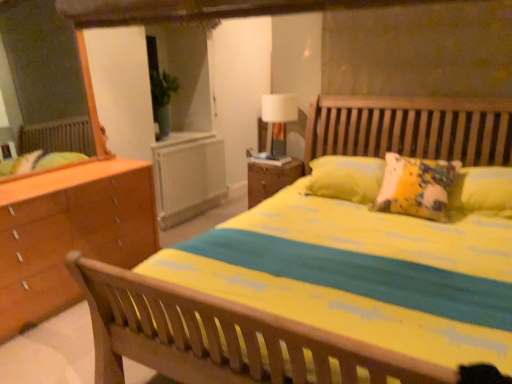
Question: Does wooden nightstand at center contain white plastic radiator at center?

Choices:
 (A) no
 (B) yes

Answer: (A)

Question: Is wooden nightstand at center not inside white plastic radiator at center?

Choices:
 (A) no
 (B) yes

Answer: (B)

Question: Can you confirm if wooden nightstand at center is taller than white plastic radiator at center?

Choices:
 (A) yes
 (B) no

Answer: (B)

Question: Does wooden nightstand at center have a smaller size compared to white plastic radiator at center?

Choices:
 (A) no
 (B) yes

Answer: (A)

Question: Is wooden nightstand at center not close to white plastic radiator at center?

Choices:
 (A) no
 (B) yes

Answer: (A)

Question: Is white plastic radiator at center in front of or behind wooden nightstand at center in the image?

Choices:
 (A) front
 (B) behind

Answer: (B)

Question: From their relative heights in the image, would you say white plastic radiator at center is taller or shorter than wooden nightstand at center?

Choices:
 (A) tall
 (B) short

Answer: (A)

Question: Based on their sizes in the image, would you say white plastic radiator at center is bigger or smaller than wooden nightstand at center?

Choices:
 (A) small
 (B) big

Answer: (A)

Question: Is white plastic radiator at center wider or thinner than wooden nightstand at center?

Choices:
 (A) wide
 (B) thin

Answer: (B)

Question: From the image's perspective, relative to wooden nightstand at center, is white fabric-covered lamp at upper center above or below?

Choices:
 (A) below
 (B) above

Answer: (B)

Question: Does point (261, 115) appear closer or farther from the camera than point (268, 195)?

Choices:
 (A) farther
 (B) closer

Answer: (A)

Question: Which is correct: white fabric-covered lamp at upper center is inside wooden nightstand at center, or outside of it?

Choices:
 (A) outside
 (B) inside

Answer: (A)

Question: In the image, is white fabric-covered lamp at upper center on the left side or the right side of wooden nightstand at center?

Choices:
 (A) left
 (B) right

Answer: (B)

Question: Is wooden nightstand at center taller or shorter than white fabric-covered lamp at upper center?

Choices:
 (A) short
 (B) tall

Answer: (A)

Question: Is wooden nightstand at center bigger or smaller than white fabric-covered lamp at upper center?

Choices:
 (A) big
 (B) small

Answer: (A)